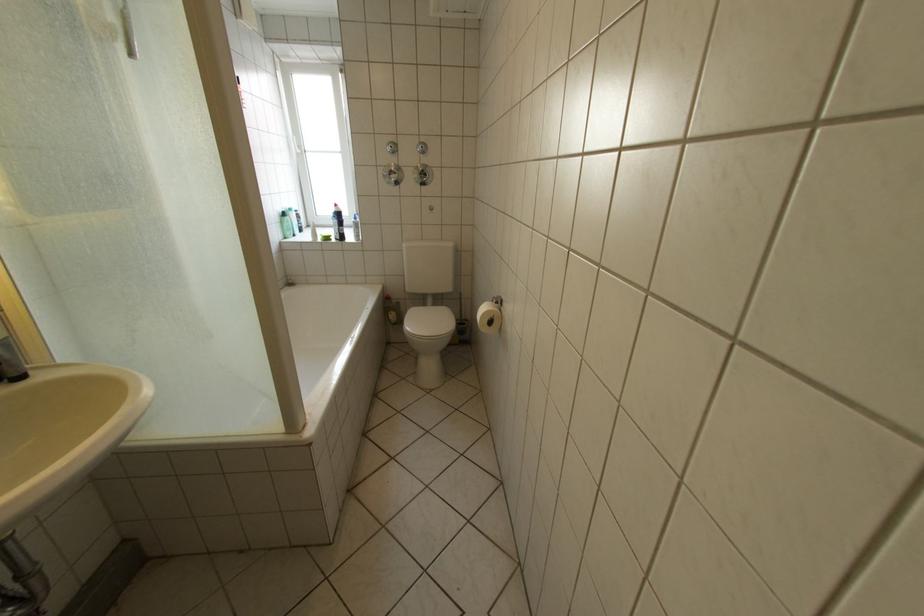
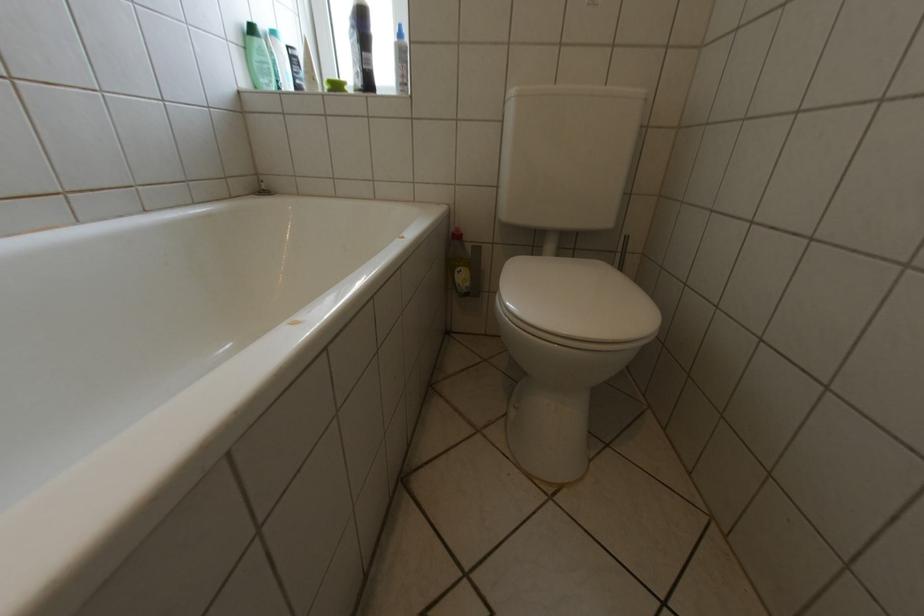
Where in the second image is the point corresponding to point 298,225 from the first image?

(268, 59)